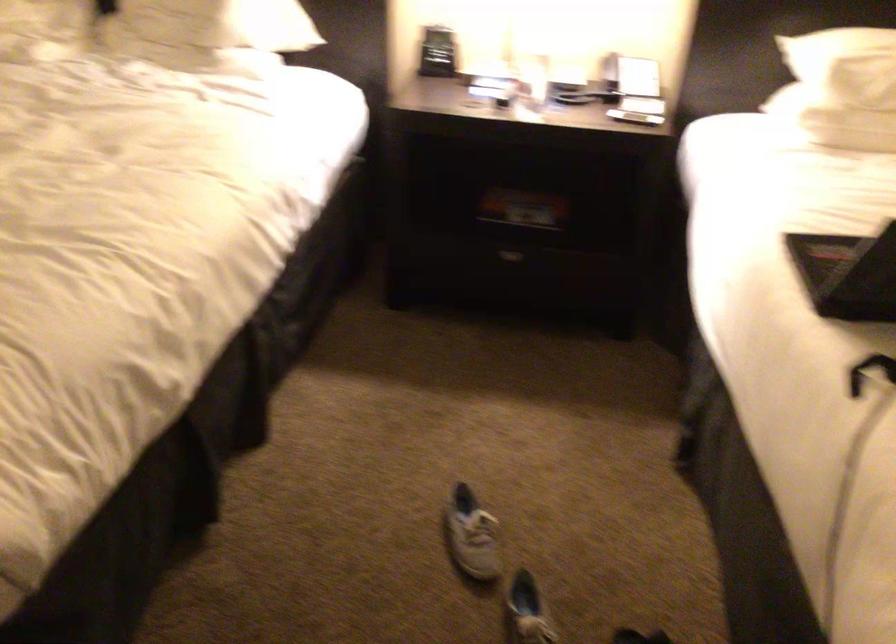
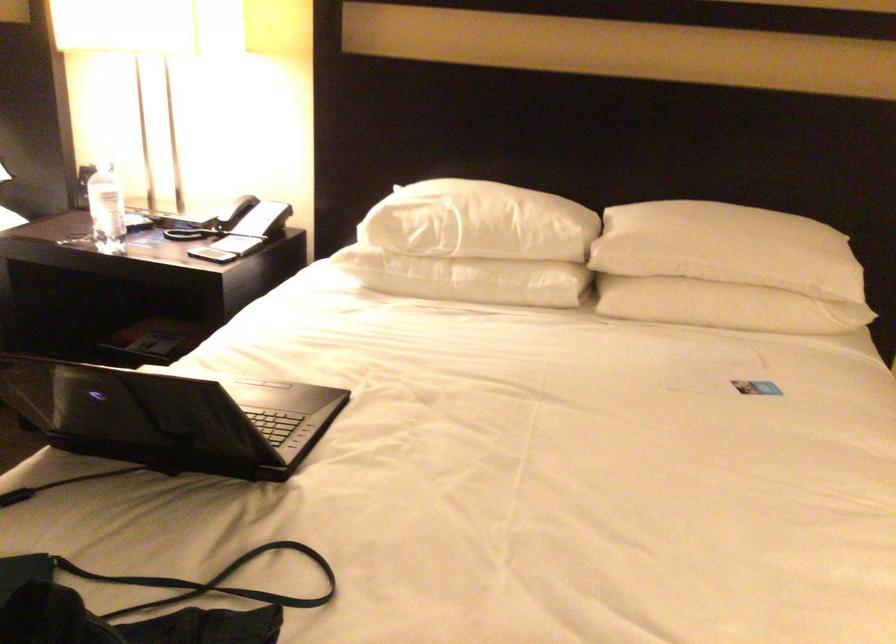
Locate, in the second image, the point that corresponds to (x=624, y=102) in the first image.

(211, 249)